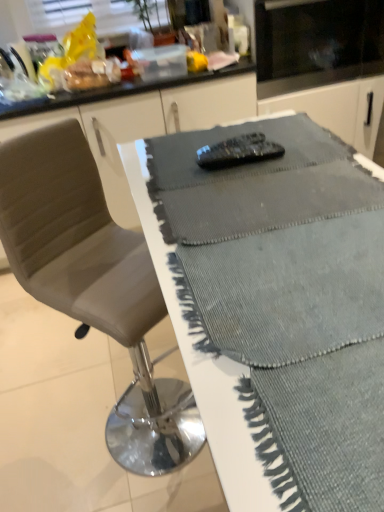
Question: Is black glass microwave at upper center to the left or to the right of textured gray table at center in the image?

Choices:
 (A) right
 (B) left

Answer: (A)

Question: Considering the positions of black glass microwave at upper center and textured gray table at center in the image, is black glass microwave at upper center wider or thinner than textured gray table at center?

Choices:
 (A) thin
 (B) wide

Answer: (B)

Question: Which is nearer to the leather-like gray chair at center?

Choices:
 (A) textured gray table at center
 (B) black glass microwave at upper center

Answer: (A)

Question: Which is nearer to the textured gray table at center?

Choices:
 (A) leather-like gray chair at center
 (B) black glass microwave at upper center

Answer: (A)